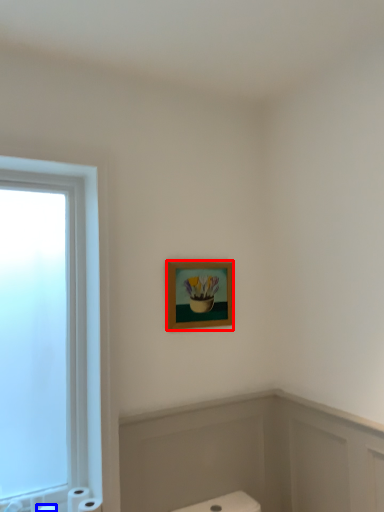
Question: Which point is closer to the camera, picture frame (highlighted by a red box) or toilet paper (highlighted by a blue box)?

Choices:
 (A) picture frame
 (B) toilet paper

Answer: (B)